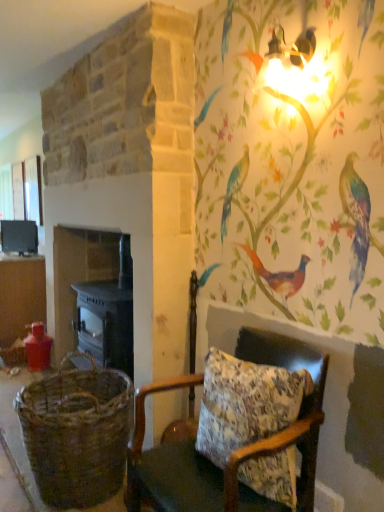
Question: Can we say matte black stove at left lies outside matte brown table at left?

Choices:
 (A) no
 (B) yes

Answer: (B)

Question: Is matte black stove at left bigger than matte brown table at left?

Choices:
 (A) yes
 (B) no

Answer: (B)

Question: From the image's perspective, does matte black stove at left appear lower than matte brown table at left?

Choices:
 (A) yes
 (B) no

Answer: (B)

Question: Is matte black stove at left far away from matte brown table at left?

Choices:
 (A) no
 (B) yes

Answer: (A)

Question: Is matte black stove at left surrounding matte brown table at left?

Choices:
 (A) yes
 (B) no

Answer: (B)

Question: From their relative heights in the image, would you say matte brown table at left is taller or shorter than dark gray stone fireplace at left?

Choices:
 (A) tall
 (B) short

Answer: (B)

Question: From the image's perspective, relative to dark gray stone fireplace at left, is matte brown table at left above or below?

Choices:
 (A) below
 (B) above

Answer: (B)

Question: Which is correct: matte brown table at left is inside dark gray stone fireplace at left, or outside of it?

Choices:
 (A) outside
 (B) inside

Answer: (A)

Question: In the image, is matte brown table at left on the left side or the right side of dark gray stone fireplace at left?

Choices:
 (A) right
 (B) left

Answer: (B)

Question: Is point (114, 273) closer or farther from the camera than point (135, 423)?

Choices:
 (A) closer
 (B) farther

Answer: (B)

Question: From their relative heights in the image, would you say dark gray stone fireplace at left is taller or shorter than floral fabric cushion at lower right?

Choices:
 (A) short
 (B) tall

Answer: (B)

Question: Considering the positions of dark gray stone fireplace at left and floral fabric cushion at lower right in the image, is dark gray stone fireplace at left wider or thinner than floral fabric cushion at lower right?

Choices:
 (A) thin
 (B) wide

Answer: (B)

Question: From a real-world perspective, is dark gray stone fireplace at left above or below floral fabric cushion at lower right?

Choices:
 (A) below
 (B) above

Answer: (B)

Question: Is floral fabric cushion at lower right bigger or smaller than matte black stove at left?

Choices:
 (A) big
 (B) small

Answer: (A)

Question: Looking at their shapes, would you say floral fabric cushion at lower right is wider or thinner than matte black stove at left?

Choices:
 (A) thin
 (B) wide

Answer: (B)